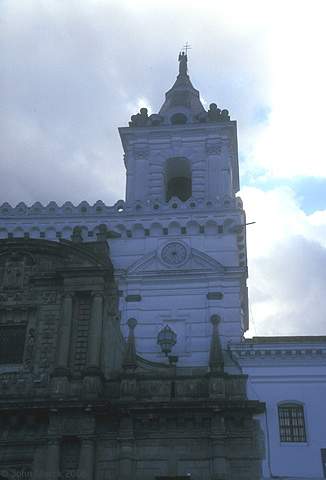
Identify the location of statue. The width and height of the screenshot is (326, 480). (185, 62).